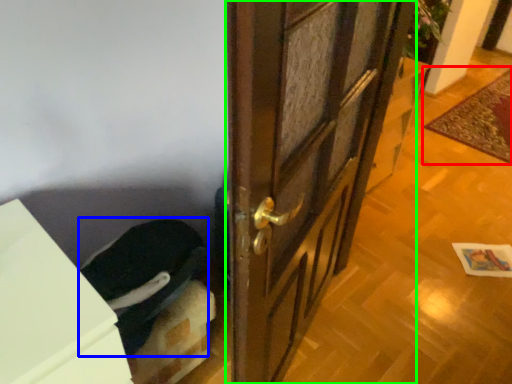
Question: Which is nearer to the doormat (highlighted by a red box)? laundry (highlighted by a blue box) or door (highlighted by a green box).

Choices:
 (A) laundry
 (B) door

Answer: (B)